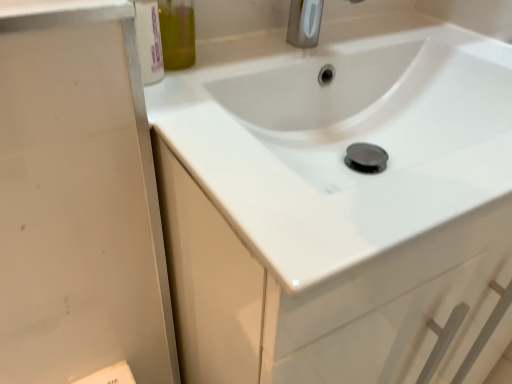
Identify the location of vacant area on the back side of satin nickel faucet at upper center. (347, 27).